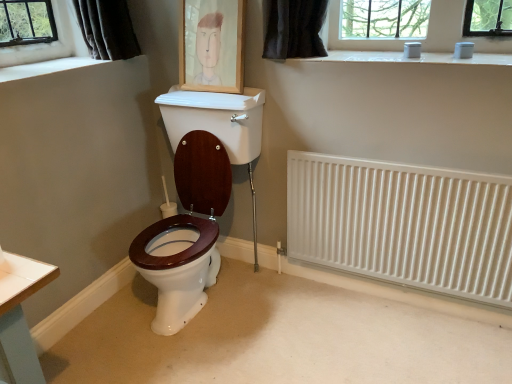
Question: From a real-world perspective, is white metallic radiator at right positioned under wooden picture frame at upper center based on gravity?

Choices:
 (A) no
 (B) yes

Answer: (B)

Question: Is white metallic radiator at right taller than wooden picture frame at upper center?

Choices:
 (A) yes
 (B) no

Answer: (A)

Question: Is white metallic radiator at right shorter than wooden picture frame at upper center?

Choices:
 (A) yes
 (B) no

Answer: (B)

Question: Would you consider white metallic radiator at right to be distant from wooden picture frame at upper center?

Choices:
 (A) no
 (B) yes

Answer: (A)

Question: Is white metallic radiator at right to the right of wooden picture frame at upper center from the viewer's perspective?

Choices:
 (A) no
 (B) yes

Answer: (B)

Question: Considering the relative sizes of white metallic radiator at right and wooden picture frame at upper center in the image provided, is white metallic radiator at right wider than wooden picture frame at upper center?

Choices:
 (A) no
 (B) yes

Answer: (A)

Question: Is white smooth window sill at upper left a part of white metallic radiator at right?

Choices:
 (A) no
 (B) yes

Answer: (A)

Question: Does white metallic radiator at right have a greater width compared to white smooth window sill at upper left?

Choices:
 (A) no
 (B) yes

Answer: (A)

Question: From a real-world perspective, is white metallic radiator at right on top of white smooth window sill at upper left?

Choices:
 (A) no
 (B) yes

Answer: (A)

Question: Considering the relative sizes of white metallic radiator at right and white smooth window sill at upper left in the image provided, is white metallic radiator at right bigger than white smooth window sill at upper left?

Choices:
 (A) yes
 (B) no

Answer: (A)

Question: Is white metallic radiator at right smaller than white smooth window sill at upper left?

Choices:
 (A) no
 (B) yes

Answer: (A)

Question: Is white metallic radiator at right thinner than white smooth window sill at upper left?

Choices:
 (A) yes
 (B) no

Answer: (A)

Question: From the image's perspective, is white smooth window sill at upper left located beneath wooden picture frame at upper center?

Choices:
 (A) no
 (B) yes

Answer: (B)